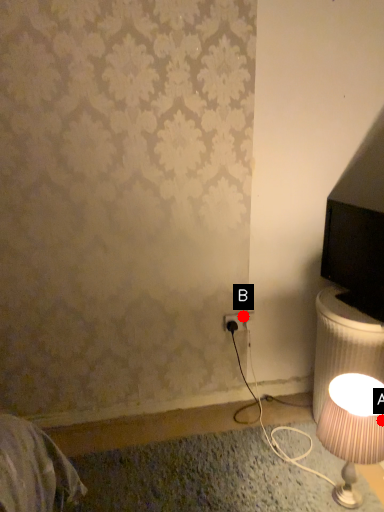
Question: Two points are circled on the image, labeled by A and B beside each circle. Which point is farther from the camera taking this photo?

Choices:
 (A) A is further
 (B) B is further

Answer: (B)